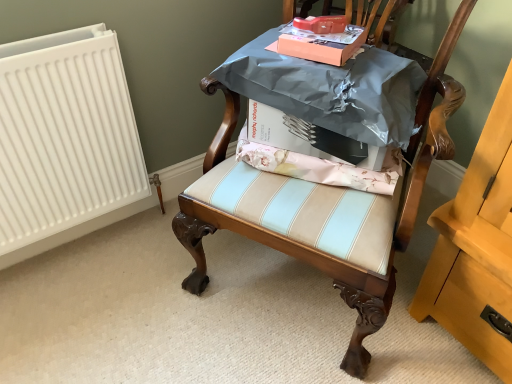
Image resolution: width=512 pixels, height=384 pixels. What are the coordinates of `vacant location below wooden chair at center (from a real-world perspective)` in the screenshot? It's located at (286, 291).